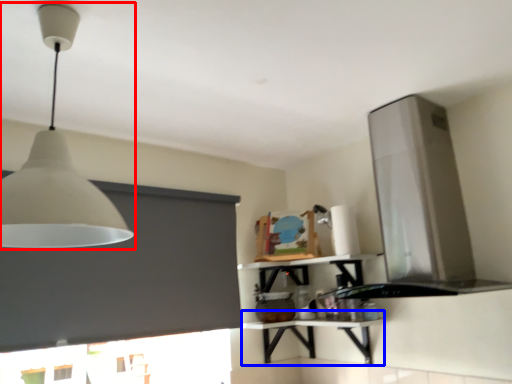
Question: Which object appears closest to the camera in this image, lamp (highlighted by a red box) or table (highlighted by a blue box)?

Choices:
 (A) lamp
 (B) table

Answer: (A)